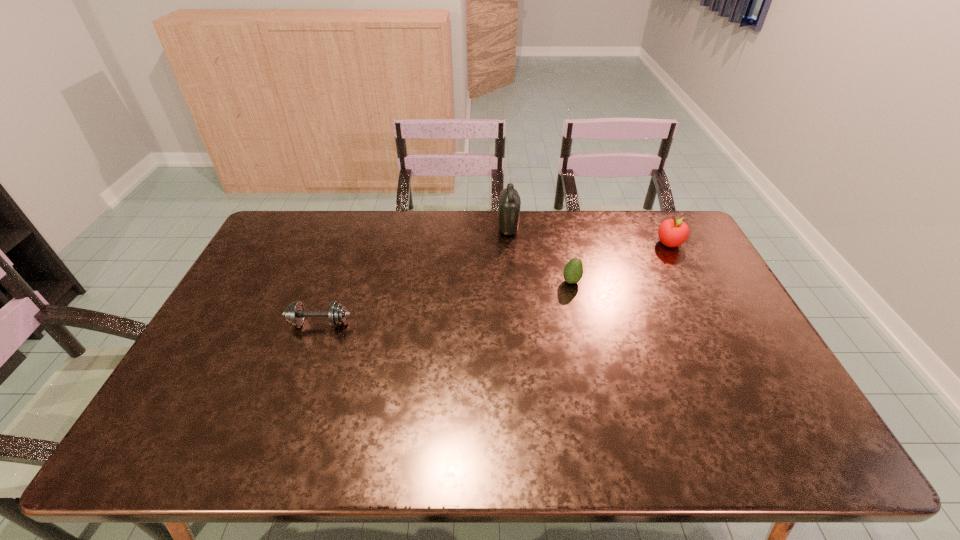
This screenshot has height=540, width=960. What are the coordinates of `object that is the third nearest to the third shortest object` in the screenshot? It's located at (295, 313).

Find the location of a particular element. the second closest object to the second tallest object is located at coordinates (509, 200).

You are a GUI agent. You are given a task and a screenshot of the screen. Output one action in this format:
    pyautogui.click(x=<x>, y=<y>)
    Task: Click on the vacant area that satisfies the following two spatial constraints: 1. on the front side of the third object from right to left; 2. on the right side of the second tallest object
    
    Given the screenshot: What is the action you would take?
    pyautogui.click(x=510, y=244)

This screenshot has width=960, height=540. What are the coordinates of `vacant space that satisfies the following two spatial constraints: 1. on the back side of the dumbbell; 2. on the left side of the third object from left to right` in the screenshot? It's located at (335, 281).